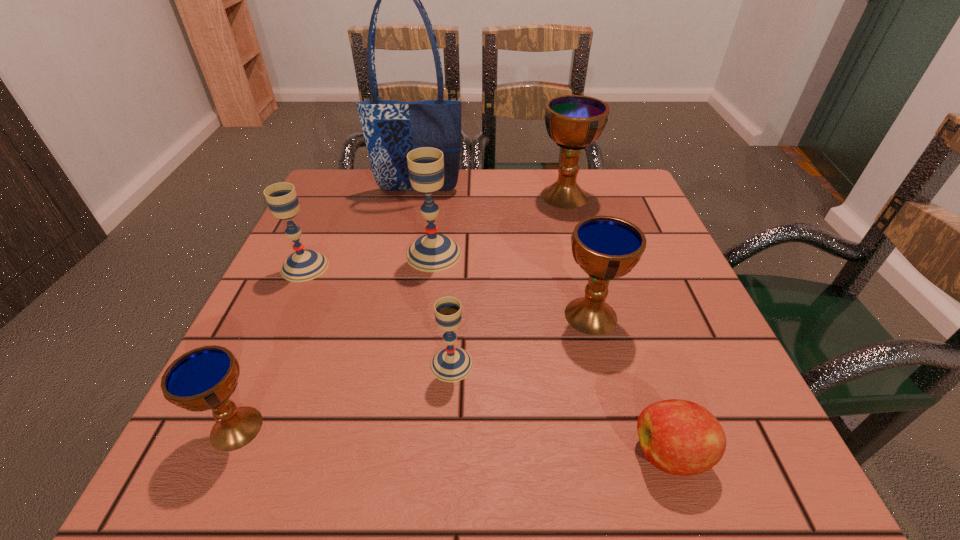
The width and height of the screenshot is (960, 540). I want to click on free space between the second biggest gray chalice and the apple, so click(x=488, y=360).

Find the location of `vacant space in between the nearest gray chalice and the farthest blue chalice`. vacant space in between the nearest gray chalice and the farthest blue chalice is located at coordinates (508, 280).

In order to click on empty space between the shopping bag and the farthest chalice in this screenshot , I will do pyautogui.click(x=492, y=193).

Locate an element on the screen. This screenshot has width=960, height=540. free spot between the smallest gray chalice and the red apple is located at coordinates (562, 409).

What are the coordinates of `vacant space in between the biggest blue chalice and the biggest gray chalice` in the screenshot? It's located at (499, 225).

Find the location of `vacant point located between the nearest blue chalice and the biggest gray chalice`. vacant point located between the nearest blue chalice and the biggest gray chalice is located at coordinates (335, 341).

Locate an element on the screen. The image size is (960, 540). free space that is in between the leftmost blue chalice and the nearest gray chalice is located at coordinates (344, 396).

Locate an element on the screen. object that can be found as the second closest to the shopping bag is located at coordinates pos(572,121).

Image resolution: width=960 pixels, height=540 pixels. I want to click on the sixth closest object to the smallest blue chalice, so click(x=391, y=129).

Locate which chalice is the fifth closest to the nearest chalice. Please provide its 2D coordinates. Your answer should be formatted as a tuple, i.e. [(x, y)], where the tuple contains the x and y coordinates of a point satisfying the conditions above.

[(572, 121)]